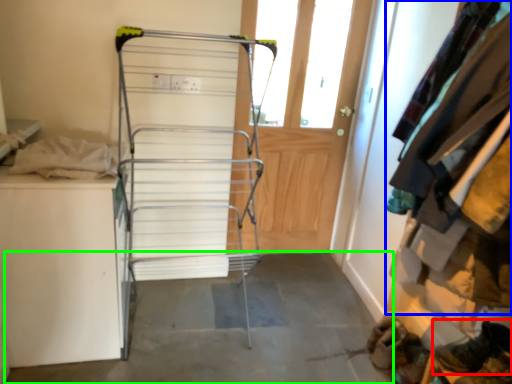
Question: Which object is the farthest from footwear (highlighted by a red box)? Choose among these: clothing (highlighted by a blue box) or concrete (highlighted by a green box).

Choices:
 (A) clothing
 (B) concrete

Answer: (B)